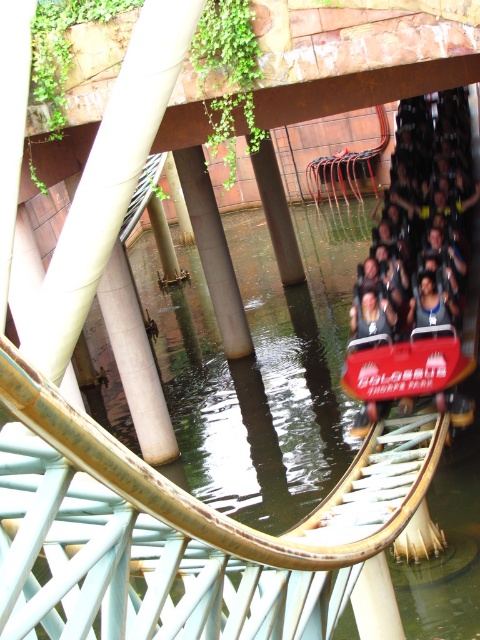
You are designing a safety inspection route for the roller coaster. The inspection team needs to reach the matte red roller coaster car at center. Given the coordinates provided, which direction should they move from the starting point at the base of the track to reach the car?

The matte red roller coaster car at center is located at coordinates point (420, 268). To reach it from the base of the track, the inspection team should move towards the upper right direction since the coordinates indicate a position that is both higher and further to the right compared to the starting point.